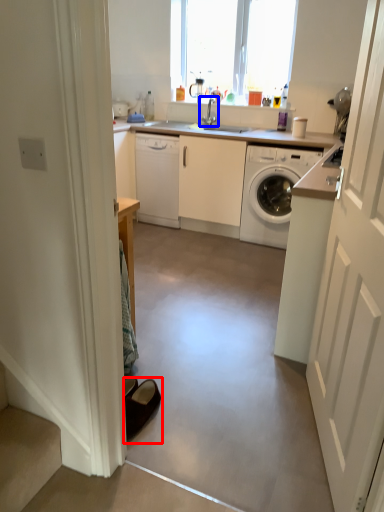
Question: Which object is closer to the camera taking this photo, footwear (highlighted by a red box) or tap (highlighted by a blue box)?

Choices:
 (A) footwear
 (B) tap

Answer: (A)